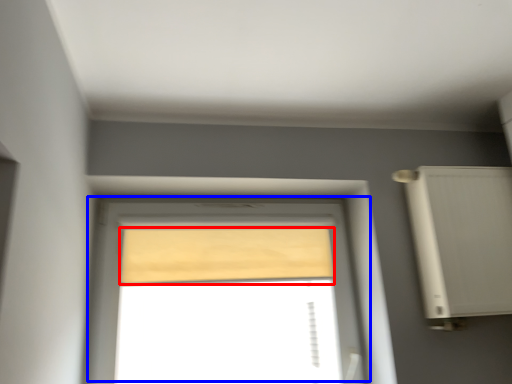
Question: Which object appears farthest to the camera in this image, curtain (highlighted by a red box) or window (highlighted by a blue box)?

Choices:
 (A) curtain
 (B) window

Answer: (A)